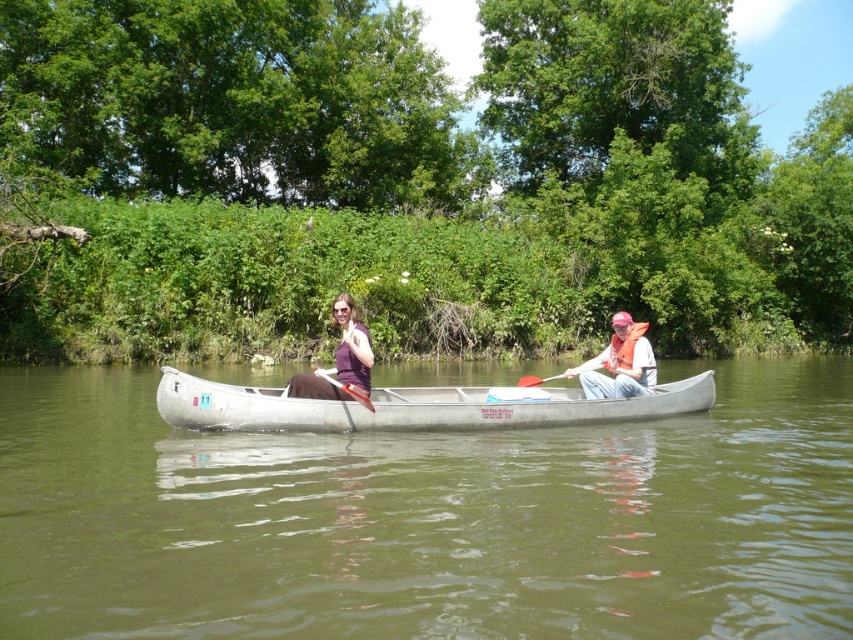
Question: Which object is positioned closest to the greenish-brown water at center?

Choices:
 (A) matte orange life vest at right
 (B) white plastic paddle at center
 (C) red plastic paddle at center
 (D) purple fabric at center

Answer: (D)

Question: Can you confirm if metallic gray canoe at center is smaller than purple fabric at center?

Choices:
 (A) yes
 (B) no

Answer: (A)

Question: Is purple fabric at center further to camera compared to red plastic paddle at center?

Choices:
 (A) yes
 (B) no

Answer: (B)

Question: Which point appears closest to the camera in this image?

Choices:
 (A) (596, 396)
 (B) (337, 410)

Answer: (B)

Question: Can you confirm if matte purple shirt at center is positioned to the right of purple fabric at center?

Choices:
 (A) no
 (B) yes

Answer: (B)

Question: Which object appears closest to the camera in this image?

Choices:
 (A) metallic gray canoe at center
 (B) purple fabric at center
 (C) matte purple shirt at center
 (D) red plastic paddle at center

Answer: (C)